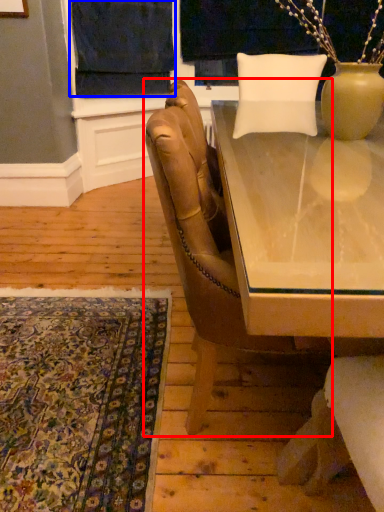
Question: Which point is closer to the camera, chair (highlighted by a red box) or curtain (highlighted by a blue box)?

Choices:
 (A) chair
 (B) curtain

Answer: (A)